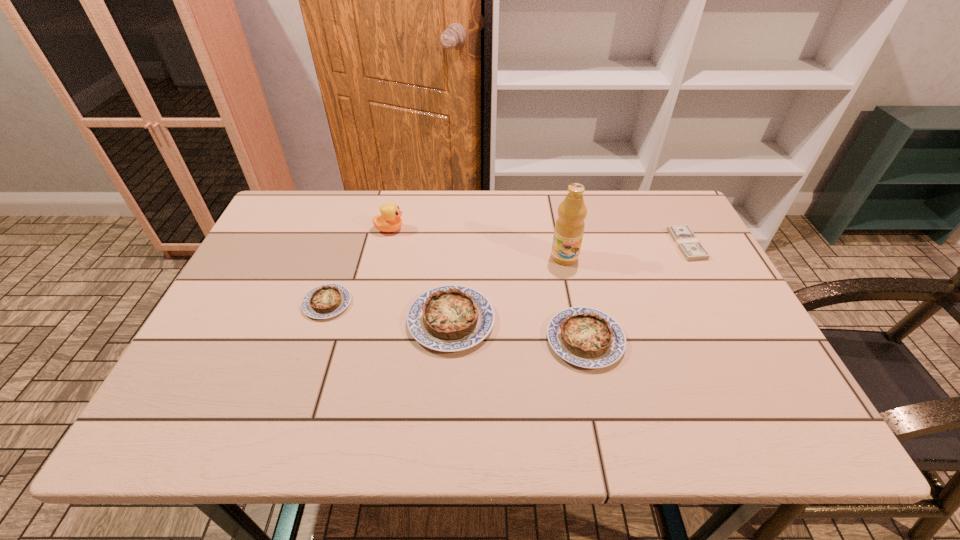
Where is `unoccupied area between the rightmost quiche and the rightmost object`? Image resolution: width=960 pixels, height=540 pixels. unoccupied area between the rightmost quiche and the rightmost object is located at coordinates (636, 292).

This screenshot has width=960, height=540. I want to click on free space between the duckling and the second shortest quiche, so click(x=488, y=284).

Locate an element on the screen. This screenshot has width=960, height=540. vacant point located between the leftmost object and the rightmost object is located at coordinates click(507, 274).

Find the location of a particular element. free area in between the leftmost object and the duckling is located at coordinates (358, 266).

The width and height of the screenshot is (960, 540). I want to click on free area in between the fifth tallest object and the rightmost object, so click(507, 274).

The image size is (960, 540). Identify the location of vacant area between the tallest object and the rightmost quiche. (575, 298).

Identify which object is the third closest to the rightmost quiche. Please provide its 2D coordinates. Your answer should be formatted as a tuple, i.e. [(x, y)], where the tuple contains the x and y coordinates of a point satisfying the conditions above.

[(691, 248)]

Image resolution: width=960 pixels, height=540 pixels. Find the location of `object that is the nearest to the rightmost object`. object that is the nearest to the rightmost object is located at coordinates (569, 228).

Identify the location of quiche that is the closest to the second tallest quiche. The height and width of the screenshot is (540, 960). (450, 318).

Select which quiche is the closest to the shortest object. Please provide its 2D coordinates. Your answer should be formatted as a tuple, i.e. [(x, y)], where the tuple contains the x and y coordinates of a point satisfying the conditions above.

[(586, 337)]